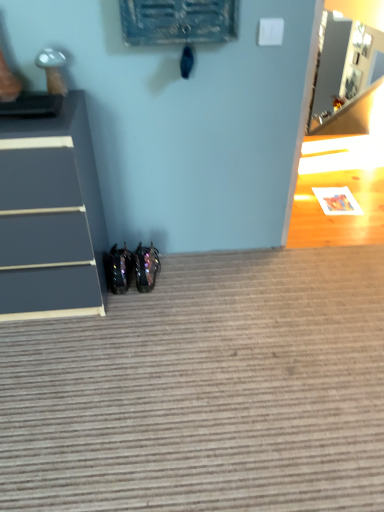
Question: Based on their positions, is glossy metallic shoes at lower center, placed as the 1th footwear when sorted from right to left, located to the left or right of glossy black shoes at lower center, which is counted as the 1th footwear, starting from the left?

Choices:
 (A) left
 (B) right

Answer: (B)

Question: From a real-world perspective, is glossy metallic shoes at lower center, placed as the 1th footwear when sorted from right to left, above or below glossy black shoes at lower center, which is counted as the 1th footwear, starting from the left?

Choices:
 (A) above
 (B) below

Answer: (A)

Question: Considering the real-world distances, which object is farthest from the textured gray carpet at lower center?

Choices:
 (A) glossy black shoes at lower center, which is the 2th footwear from right to left
 (B) matte gray chest of drawers at left
 (C) glossy metallic shoes at lower center, the 2th footwear in the left-to-right sequence

Answer: (A)

Question: Which is farther from the textured gray carpet at lower center?

Choices:
 (A) glossy metallic shoes at lower center, the 2th footwear in the left-to-right sequence
 (B) glossy black shoes at lower center, which is counted as the 1th footwear, starting from the left
 (C) matte gray chest of drawers at left

Answer: (B)